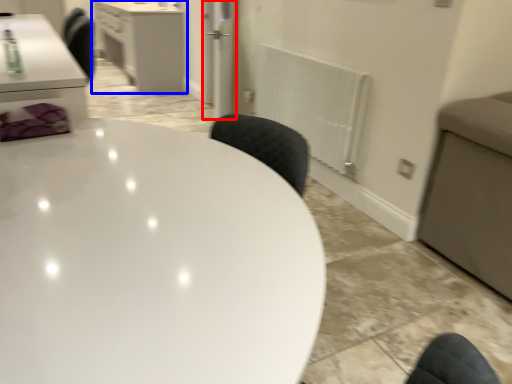
Question: Which object is closer to the camera taking this photo, glass door (highlighted by a red box) or cabinetry (highlighted by a blue box)?

Choices:
 (A) glass door
 (B) cabinetry

Answer: (A)